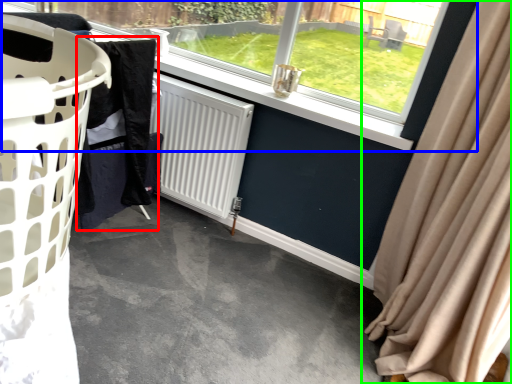
Question: Estimate the real-world distances between objects in this image. Which object is farther from clothing (highlighted by a red box), window (highlighted by a blue box) or curtain (highlighted by a green box)?

Choices:
 (A) window
 (B) curtain

Answer: (B)